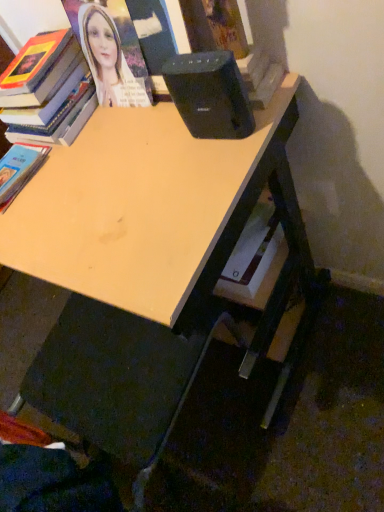
What is the approximate width of hardcover book at upper left, which is the 2th book in bottom-to-top order?

9.91 inches.

Where is `hardcover book at lower left, marked as the second book in a top-to-bottom arrangement`? This screenshot has width=384, height=512. hardcover book at lower left, marked as the second book in a top-to-bottom arrangement is located at coordinates (19, 170).

Who is bigger, hardcover book at upper left, which is the first book from top to bottom, or hardcover book at lower left, marked as the second book in a top-to-bottom arrangement?

Bigger between the two is hardcover book at upper left, which is the first book from top to bottom.

In terms of height, does hardcover book at upper left, which is the first book from top to bottom, look taller or shorter compared to hardcover book at lower left, marked as the second book in a top-to-bottom arrangement?

Clearly, hardcover book at upper left, which is the first book from top to bottom, is taller compared to hardcover book at lower left, marked as the second book in a top-to-bottom arrangement.

How distant is hardcover book at upper left, which is the 2th book in bottom-to-top order, from hardcover book at lower left, marked as the second book in a top-to-bottom arrangement?

They are 3.61 inches apart.

The width and height of the screenshot is (384, 512). Identify the location of book below the hardcover book at upper left, which is the 2th book in bottom-to-top order (from a real-world perspective). (19, 170).

How different are the orientations of hardcover book at lower left, marked as the second book in a top-to-bottom arrangement, and light wood desk at center in degrees?

hardcover book at lower left, marked as the second book in a top-to-bottom arrangement, and light wood desk at center are facing 0.832 degrees away from each other.

Is light wood desk at center surrounded by hardcover book at lower left, marked as the second book in a top-to-bottom arrangement?

Definitely not — light wood desk at center is not inside hardcover book at lower left, marked as the second book in a top-to-bottom arrangement.

Considering the positions of objects hardcover book at lower left, marked as the second book in a top-to-bottom arrangement, and light wood desk at center in the image provided, who is behind, hardcover book at lower left, marked as the second book in a top-to-bottom arrangement, or light wood desk at center?

hardcover book at lower left, marked as the second book in a top-to-bottom arrangement.

Could you measure the distance between hardcover book at lower left, acting as the 1th book starting from the bottom, and light wood desk at center?

hardcover book at lower left, acting as the 1th book starting from the bottom, and light wood desk at center are 14.08 inches apart from each other.

Is hardcover book at upper left, which is the first book from top to bottom, far from light wood desk at center?

hardcover book at upper left, which is the first book from top to bottom, is near light wood desk at center, not far away.

Looking at this image, which of these two, hardcover book at upper left, which is the first book from top to bottom, or light wood desk at center, stands shorter?

hardcover book at upper left, which is the first book from top to bottom, is shorter.

From a real-world perspective, is hardcover book at upper left, which is the first book from top to bottom, under light wood desk at center?

Actually, hardcover book at upper left, which is the first book from top to bottom, is physically above light wood desk at center in the real world.

Consider the image. How many degrees apart are the facing directions of hardcover book at upper left, which is the first book from top to bottom, and light wood desk at center?

They differ by 2 degrees in their facing directions.

From the image's perspective, which book is the 2nd one above the light wood desk at center? Please provide its 2D coordinates.

[(56, 104)]

From a real-world perspective, is light wood desk at center on hardcover book at upper left, which is the 2th book in bottom-to-top order?

Actually, light wood desk at center is physically below hardcover book at upper left, which is the 2th book in bottom-to-top order, in the real world.

In the scene shown: Which of these two, light wood desk at center or hardcover book at upper left, which is the first book from top to bottom, is bigger?

Bigger between the two is light wood desk at center.

Between light wood desk at center and hardcover book at upper left, which is the first book from top to bottom, which one is positioned behind?

hardcover book at upper left, which is the first book from top to bottom, is further away from the camera.

Considering the relative positions of hardcover book at lower left, marked as the second book in a top-to-bottom arrangement, and black plastic speaker at upper center in the image provided, is hardcover book at lower left, marked as the second book in a top-to-bottom arrangement, to the right of black plastic speaker at upper center from the viewer's perspective?

Incorrect, hardcover book at lower left, marked as the second book in a top-to-bottom arrangement, is not on the right side of black plastic speaker at upper center.

Is hardcover book at lower left, acting as the 1th book starting from the bottom, situated inside black plastic speaker at upper center or outside?

hardcover book at lower left, acting as the 1th book starting from the bottom, is outside black plastic speaker at upper center.

You are a GUI agent. You are given a task and a screenshot of the screen. Output one action in this format:
    pyautogui.click(x=<x>, y=<y>)
    Task: Click on the speaker that appears above the hardcover book at lower left, acting as the 1th book starting from the bottom (from a real-world perspective)
    
    Given the screenshot: What is the action you would take?
    pyautogui.click(x=210, y=95)

Which is closer, (1, 187) or (211, 117)?

Positioned in front is point (211, 117).

Does hardcover book at lower left, acting as the 1th book starting from the bottom, have a lesser width compared to hardcover book at upper left, which is the first book from top to bottom?

Correct, the width of hardcover book at lower left, acting as the 1th book starting from the bottom, is less than that of hardcover book at upper left, which is the first book from top to bottom.

Is hardcover book at lower left, marked as the second book in a top-to-bottom arrangement, not within hardcover book at upper left, which is the first book from top to bottom?

That's correct, hardcover book at lower left, marked as the second book in a top-to-bottom arrangement, is outside of hardcover book at upper left, which is the first book from top to bottom.

From the image's perspective, is hardcover book at lower left, acting as the 1th book starting from the bottom, located beneath hardcover book at upper left, which is the 2th book in bottom-to-top order?

Yes.

Find the location of `book above the hardcover book at lower left, acting as the 1th book starting from the bottom (from the image's perspective)`. book above the hardcover book at lower left, acting as the 1th book starting from the bottom (from the image's perspective) is located at coordinates (56, 104).

How far apart are black plastic speaker at upper center and light wood desk at center?

12.05 inches.

Which object is wider, black plastic speaker at upper center or light wood desk at center?

With larger width is light wood desk at center.

From the image's perspective, which object appears higher, black plastic speaker at upper center or light wood desk at center?

black plastic speaker at upper center, from the image's perspective.

Which is more to the right, black plastic speaker at upper center or light wood desk at center?

From the viewer's perspective, black plastic speaker at upper center appears more on the right side.

At what (x,y) coordinates should I click in order to perform the action: click on book directly beneath the hardcover book at upper left, which is the 2th book in bottom-to-top order (from a real-world perspective). Please return your answer as a coordinate pair (x, y). Looking at the image, I should click on (19, 170).

Where is `desk that is on the right side of hardcover book at lower left, marked as the second book in a top-to-bottom arrangement`? desk that is on the right side of hardcover book at lower left, marked as the second book in a top-to-bottom arrangement is located at coordinates (147, 261).

When comparing their distances from black plastic speaker at upper center, does hardcover book at lower left, marked as the second book in a top-to-bottom arrangement, or light wood desk at center seem closer?

light wood desk at center lies closer to black plastic speaker at upper center than the other object.

Estimate the real-world distances between objects in this image. Which object is further from hardcover book at upper left, which is the 2th book in bottom-to-top order, hardcover book at lower left, marked as the second book in a top-to-bottom arrangement, or black plastic speaker at upper center?

Among the two, black plastic speaker at upper center is located further to hardcover book at upper left, which is the 2th book in bottom-to-top order.

Looking at this image, considering their positions, is light wood desk at center positioned further to black plastic speaker at upper center than hardcover book at upper left, which is the 2th book in bottom-to-top order?

The object further to black plastic speaker at upper center is hardcover book at upper left, which is the 2th book in bottom-to-top order.

Based on their spatial positions, is hardcover book at lower left, marked as the second book in a top-to-bottom arrangement, or hardcover book at upper left, which is the 2th book in bottom-to-top order, closer to black plastic speaker at upper center?

Based on the image, hardcover book at upper left, which is the 2th book in bottom-to-top order, appears to be nearer to black plastic speaker at upper center.

Which object lies further to the anchor point light wood desk at center, black plastic speaker at upper center or hardcover book at lower left, marked as the second book in a top-to-bottom arrangement?

The object further to light wood desk at center is hardcover book at lower left, marked as the second book in a top-to-bottom arrangement.

When comparing their distances from black plastic speaker at upper center, does hardcover book at upper left, which is the 2th book in bottom-to-top order, or hardcover book at lower left, acting as the 1th book starting from the bottom, seem further?

hardcover book at lower left, acting as the 1th book starting from the bottom.

Based on their spatial positions, is hardcover book at upper left, which is the 2th book in bottom-to-top order, or black plastic speaker at upper center closer to light wood desk at center?

black plastic speaker at upper center is positioned closer to the anchor light wood desk at center.

Which object lies nearer to the anchor point hardcover book at lower left, marked as the second book in a top-to-bottom arrangement, hardcover book at upper left, which is the 2th book in bottom-to-top order, or light wood desk at center?

Based on the image, hardcover book at upper left, which is the 2th book in bottom-to-top order, appears to be nearer to hardcover book at lower left, marked as the second book in a top-to-bottom arrangement.

I want to click on book between hardcover book at upper left, which is the 2th book in bottom-to-top order, and light wood desk at center from top to bottom, so click(x=19, y=170).

The width and height of the screenshot is (384, 512). Find the location of `desk located between hardcover book at lower left, marked as the second book in a top-to-bottom arrangement, and black plastic speaker at upper center in the left-right direction`. desk located between hardcover book at lower left, marked as the second book in a top-to-bottom arrangement, and black plastic speaker at upper center in the left-right direction is located at coordinates (147, 261).

This screenshot has width=384, height=512. In order to click on speaker between hardcover book at upper left, which is the first book from top to bottom, and light wood desk at center vertically in this screenshot , I will do `click(210, 95)`.

Locate an element on the screen. This screenshot has height=512, width=384. book situated between hardcover book at lower left, acting as the 1th book starting from the bottom, and black plastic speaker at upper center from left to right is located at coordinates tap(56, 104).